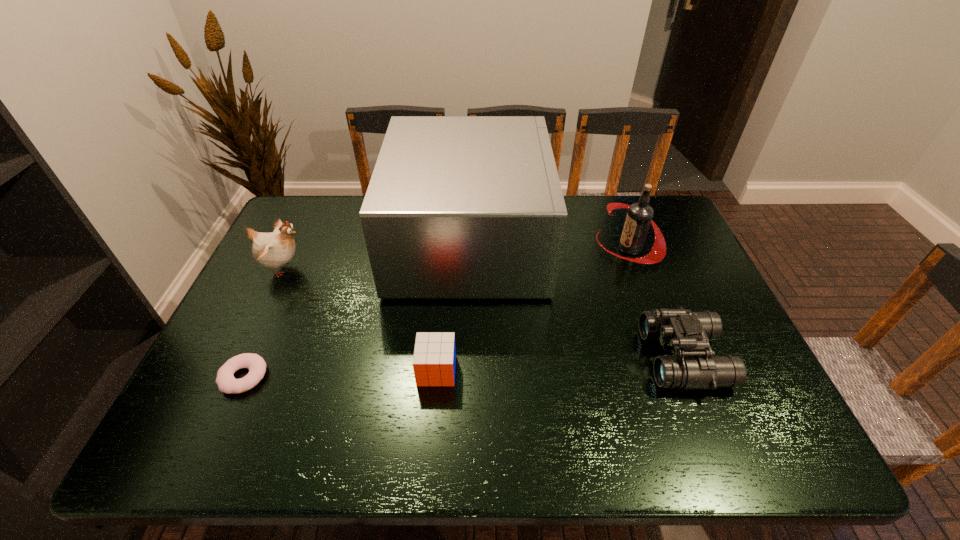
Image resolution: width=960 pixels, height=540 pixels. I want to click on root beer positioned at the right edge, so click(x=639, y=217).

You are a GUI agent. You are given a task and a screenshot of the screen. Output one action in this format:
    pyautogui.click(x=<x>, y=<y>)
    Task: Click on the binoculars at the right edge
    The image size is (960, 540).
    Given the screenshot: What is the action you would take?
    pyautogui.click(x=694, y=365)

The width and height of the screenshot is (960, 540). Find the location of `object at the far right corner`. object at the far right corner is located at coordinates (639, 217).

Find the location of a particular element. This screenshot has height=540, width=960. free space at the far edge of the desktop is located at coordinates (569, 235).

Image resolution: width=960 pixels, height=540 pixels. What are the coordinates of `vacant space at the near edge of the desktop` in the screenshot? It's located at (490, 428).

In the image, there is a desktop. At what (x,y) coordinates should I click in order to perform the action: click on vacant space at the left edge. Please return your answer as a coordinate pair (x, y). Looking at the image, I should click on (267, 382).

The width and height of the screenshot is (960, 540). Find the location of `vacant space at the far right corner of the desktop`. vacant space at the far right corner of the desktop is located at coordinates (661, 204).

Image resolution: width=960 pixels, height=540 pixels. What are the coordinates of `empty space that is in between the shortest object and the tallest object` in the screenshot? It's located at (357, 309).

You are a GUI agent. You are given a task and a screenshot of the screen. Output one action in this format:
    pyautogui.click(x=<x>, y=<y>)
    Task: Click on the free spot between the shortest object and the second shortest object
    The width and height of the screenshot is (960, 540).
    Given the screenshot: What is the action you would take?
    pyautogui.click(x=340, y=374)

Identify the location of vacant point located between the shortest object and the binoculars. (464, 367).